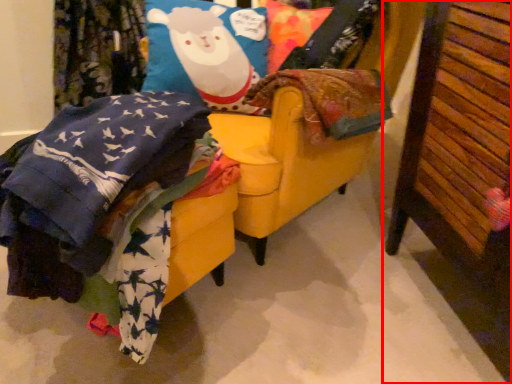
Question: From the image's perspective, what is the correct spatial positioning of furniture (annotated by the red box) in reference to swivel chair?

Choices:
 (A) above
 (B) below

Answer: (B)